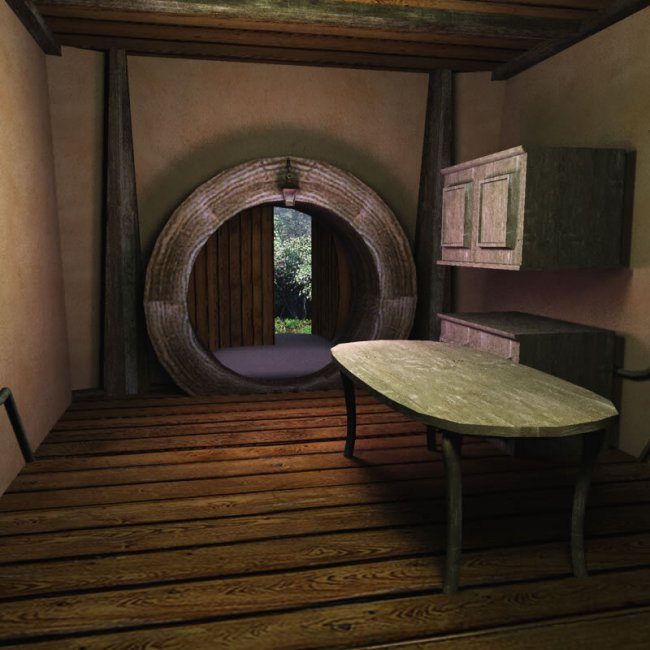
You are a GUI agent. You are given a task and a screenshot of the screen. Output one action in this format:
    pyautogui.click(x=<x>, y=<y>)
    Task: Click on the table legs
    
    Given the screenshot: What is the action you would take?
    pyautogui.click(x=456, y=509), pyautogui.click(x=578, y=513), pyautogui.click(x=348, y=413), pyautogui.click(x=431, y=435)